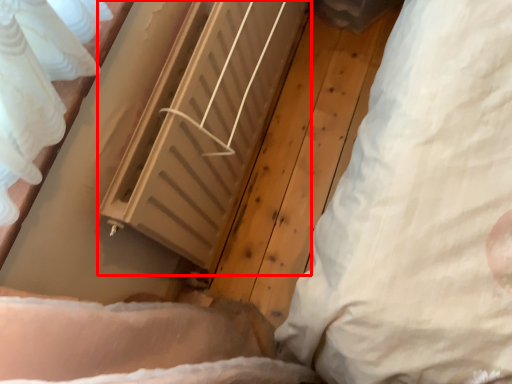
Question: From the image's perspective, what is the correct spatial relationship of radiator (annotated by the red box) in relation to pillow?

Choices:
 (A) above
 (B) below

Answer: (A)